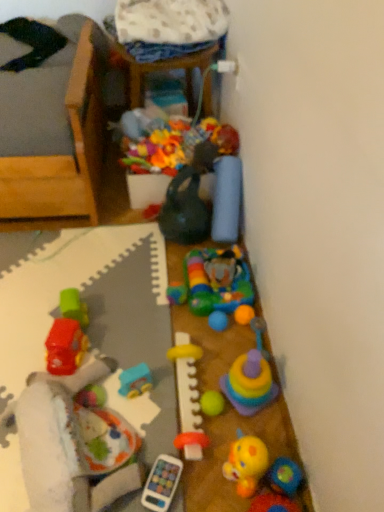
Where is `empty space that is in between yellow rubber teething ring at center, positioned as the eighth toy in right-to-left order, and rubberized plastic stacking cups at center-right, the ninth toy from the left`? This screenshot has width=384, height=512. empty space that is in between yellow rubber teething ring at center, positioned as the eighth toy in right-to-left order, and rubberized plastic stacking cups at center-right, the ninth toy from the left is located at coordinates (227, 397).